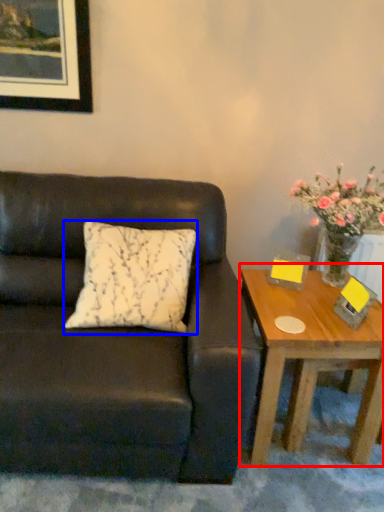
Question: Which object appears closest to the camera in this image, coffee table (highlighted by a red box) or pillow (highlighted by a blue box)?

Choices:
 (A) coffee table
 (B) pillow

Answer: (B)